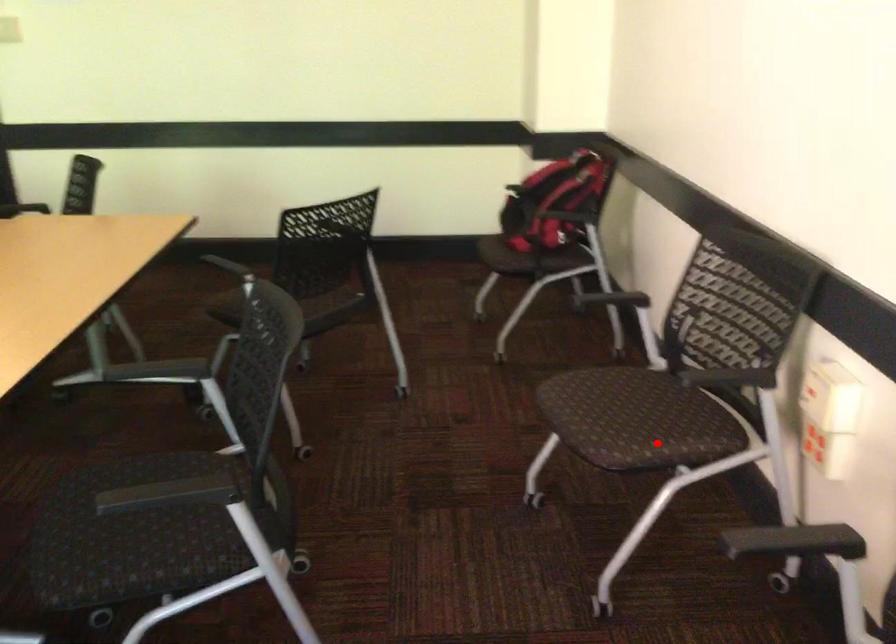
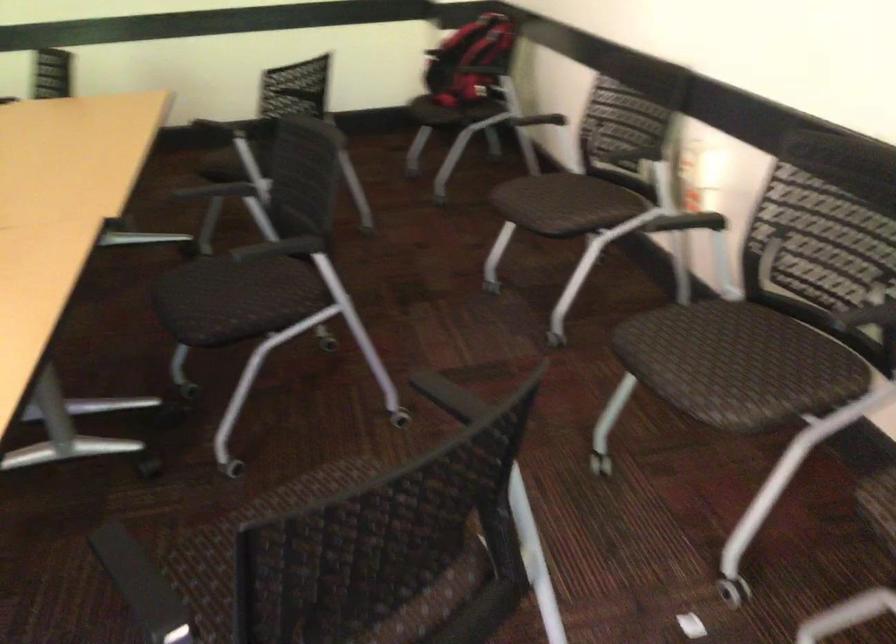
Question: I am providing you with two images of the same scene from different viewpoints. Given a red point in image1, look at the same physical point in image2. Is it:

Choices:
 (A) Closer to the viewpoint
 (B) Farther from the viewpoint

Answer: (B)